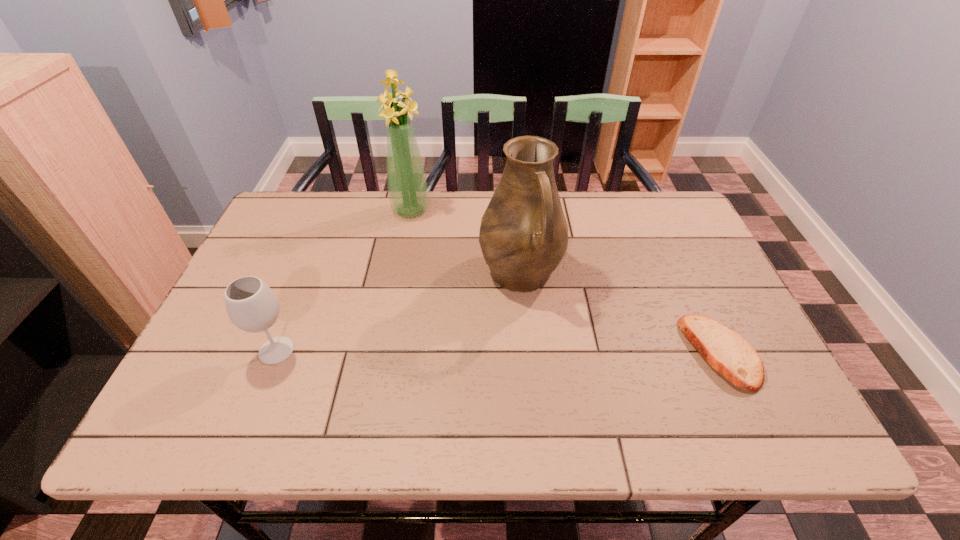
What are the coordinates of `object that is positioned at the right edge` in the screenshot? It's located at (726, 351).

I want to click on object at the near left corner, so click(x=252, y=306).

At what (x,y) coordinates should I click in order to perform the action: click on object located at the near right corner. Please return your answer as a coordinate pair (x, y). This screenshot has height=540, width=960. Looking at the image, I should click on (726, 351).

The image size is (960, 540). Identify the location of blank space at the far edge. (366, 202).

Identify the location of vacant space at the near edge of the desktop. (302, 392).

Locate an element on the screen. The height and width of the screenshot is (540, 960). vacant area at the left edge of the desktop is located at coordinates (291, 270).

Locate an element on the screen. free region at the right edge is located at coordinates (688, 269).

Identify the location of vacant position at the far left corner of the desktop. This screenshot has width=960, height=540. (274, 228).

Locate an element on the screen. Image resolution: width=960 pixels, height=540 pixels. vacant area that lies between the pita bread and the wineglass is located at coordinates (498, 352).

Identify the location of free spot between the shortest object and the second farthest object. (620, 313).